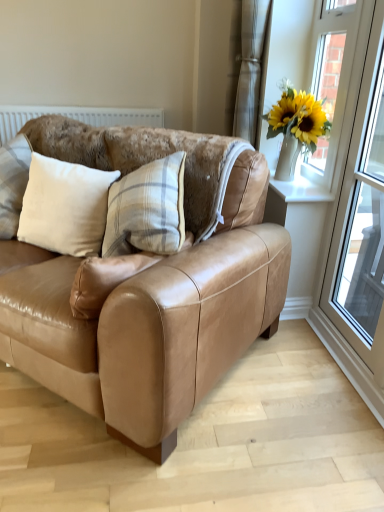
The height and width of the screenshot is (512, 384). Describe the element at coordinates (250, 68) in the screenshot. I see `white textured curtain at upper center` at that location.

What do you see at coordinates (331, 80) in the screenshot? I see `white glass window at upper right` at bounding box center [331, 80].

What do you see at coordinates (299, 190) in the screenshot? I see `white smooth window sill at upper right` at bounding box center [299, 190].

What do you see at coordinates (361, 219) in the screenshot?
I see `white plastic window frame at right` at bounding box center [361, 219].

The width and height of the screenshot is (384, 512). What are the coordinates of `tan leather couch at center` in the screenshot? It's located at (148, 316).

Measure the distance between beige fabric pillow at left and camera.

beige fabric pillow at left is 5.32 feet from camera.

I want to click on white textured curtain at upper center, so click(250, 68).

From a real-world perspective, is tan leather couch at center below white glass window at upper right?

Yes, from a real-world perspective, tan leather couch at center is below white glass window at upper right.

How distant is tan leather couch at center from white glass window at upper right?

35.64 inches.

Considering the relative positions of tan leather couch at center and white glass window at upper right in the image provided, is tan leather couch at center to the left of white glass window at upper right from the viewer's perspective?

Indeed, tan leather couch at center is positioned on the left side of white glass window at upper right.

Is tan leather couch at center oriented towards white smooth window sill at upper right?

No, tan leather couch at center does not turn towards white smooth window sill at upper right.

Which of these two, tan leather couch at center or white smooth window sill at upper right, stands shorter?

With less height is white smooth window sill at upper right.

This screenshot has height=512, width=384. In order to click on window sill located above the tan leather couch at center (from the image's perspective) in this screenshot , I will do `click(299, 190)`.

From a real-world perspective, which is physically above, tan leather couch at center or white smooth window sill at upper right?

In real-world perspective, white smooth window sill at upper right is above.

In the scene shown: Is white glass window at upper right far away from beige fabric pillow at left?

That's right, there is a large distance between white glass window at upper right and beige fabric pillow at left.

From a real-world perspective, which object rests below the other?

beige fabric pillow at left, from a real-world perspective.

Which of these two, white glass window at upper right or beige fabric pillow at left, stands shorter?

Standing shorter between the two is beige fabric pillow at left.

Does white glass window at upper right turn towards beige fabric pillow at left?

Yes, white glass window at upper right is oriented towards beige fabric pillow at left.

Considering the relative sizes of tan leather couch at center and white plastic window frame at right in the image provided, is tan leather couch at center shorter than white plastic window frame at right?

Yes.

Visually, is tan leather couch at center positioned to the left or to the right of white plastic window frame at right?

tan leather couch at center is positioned on white plastic window frame at right's left side.

Considering the sizes of objects tan leather couch at center and white plastic window frame at right in the image provided, who is bigger, tan leather couch at center or white plastic window frame at right?

tan leather couch at center.

Is white plastic window frame at right not inside white smooth window sill at upper right?

Indeed, white plastic window frame at right is completely outside white smooth window sill at upper right.

In terms of height, does white plastic window frame at right look taller or shorter compared to white smooth window sill at upper right?

white plastic window frame at right is taller than white smooth window sill at upper right.

Looking at this image, how different are the orientations of beige fabric pillow at left and tan leather couch at center in degrees?

They differ by 5.54 degrees in their facing directions.

Between point (33, 155) and point (186, 275), which one is positioned in front?

The point (186, 275) is closer to the camera.

Considering the relative positions of beige fabric pillow at left and tan leather couch at center in the image provided, is beige fabric pillow at left to the left of tan leather couch at center from the viewer's perspective?

Yes.

Considering the sizes of objects beige fabric pillow at left and tan leather couch at center in the image provided, who is bigger, beige fabric pillow at left or tan leather couch at center?

tan leather couch at center is bigger.

Is the depth of white plastic window frame at right less than that of beige fabric pillow at left?

Yes, white plastic window frame at right is closer to the camera.

Which of these two, white plastic window frame at right or beige fabric pillow at left, is wider?

beige fabric pillow at left.

What's the angular difference between white plastic window frame at right and beige fabric pillow at left's facing directions?

52.2 degrees.

How far apart are white plastic window frame at right and beige fabric pillow at left?

3.69 feet.

Identify the location of studio couch located in front of the white glass window at upper right. The image size is (384, 512). (148, 316).

Locate an element on the screen. This screenshot has width=384, height=512. window sill that appears on the right of tan leather couch at center is located at coordinates (299, 190).

In the scene shown: When comparing their distances from white glass window at upper right, does beige fabric pillow at left or white smooth window sill at upper right seem further?

beige fabric pillow at left is further to white glass window at upper right.

When comparing their distances from white textured curtain at upper center, does beige fabric pillow at left or white glass window at upper right seem further?

The object further to white textured curtain at upper center is beige fabric pillow at left.

Considering their positions, is beige fabric pillow at left positioned closer to white smooth window sill at upper right than tan leather couch at center?

tan leather couch at center is closer to white smooth window sill at upper right.

Looking at the image, which one is located closer to beige fabric pillow at left, white glass window at upper right or white plastic window frame at right?

white glass window at upper right is positioned closer to the anchor beige fabric pillow at left.

When comparing their distances from white textured curtain at upper center, does white smooth window sill at upper right or white glass window at upper right seem further?

Among the two, white smooth window sill at upper right is located further to white textured curtain at upper center.

When comparing their distances from white smooth window sill at upper right, does tan leather couch at center or white glass window at upper right seem further?

tan leather couch at center.

Estimate the real-world distances between objects in this image. Which object is closer to white textured curtain at upper center, tan leather couch at center or white plastic window frame at right?

white plastic window frame at right is closer to white textured curtain at upper center.

Considering their positions, is white glass window at upper right positioned further to white plastic window frame at right than white smooth window sill at upper right?

white glass window at upper right is further to white plastic window frame at right.

The width and height of the screenshot is (384, 512). What are the coordinates of `window sill between beige fabric pillow at left and white glass window at upper right` in the screenshot? It's located at (299, 190).

Locate an element on the screen. curtain situated between tan leather couch at center and white glass window at upper right from left to right is located at coordinates (250, 68).

Identify the location of window between white plastic window frame at right and white smooth window sill at upper right from front to back. (331, 80).

Where is `window located between tan leather couch at center and white plastic window frame at right in the left-right direction`? The image size is (384, 512). window located between tan leather couch at center and white plastic window frame at right in the left-right direction is located at coordinates (331, 80).